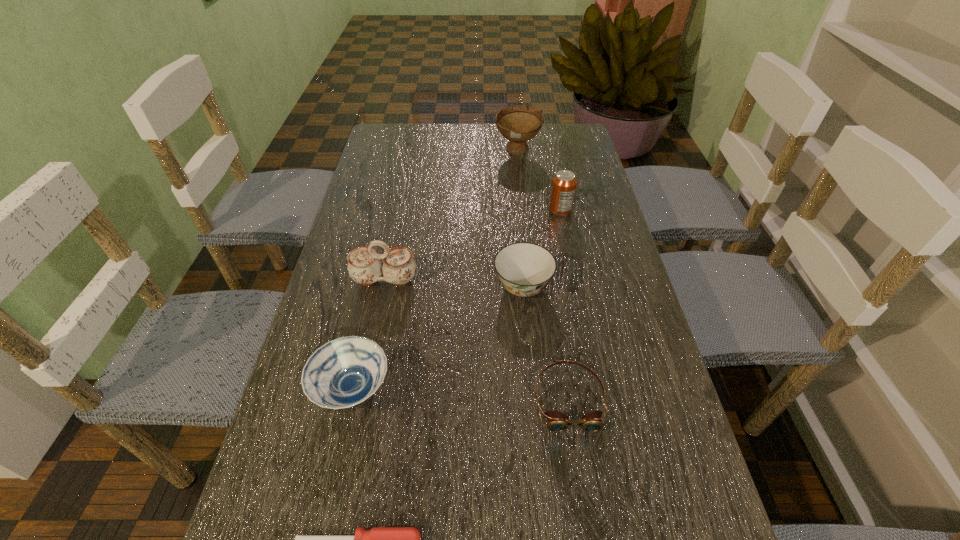
The width and height of the screenshot is (960, 540). What are the coordinates of `vacant space at the right edge of the desktop` in the screenshot? It's located at (602, 196).

The image size is (960, 540). In the image, there is a desktop. What are the coordinates of `vacant space at the far left corner` in the screenshot? It's located at (375, 153).

Image resolution: width=960 pixels, height=540 pixels. In the image, there is a desktop. Identify the location of vacant space at the far right corner. (584, 158).

Locate an element on the screen. free space that is in between the sixth tallest object and the chinaware is located at coordinates (476, 339).

Find the location of a particular element. The height and width of the screenshot is (540, 960). free space between the chinaware and the second nearest soup bowl is located at coordinates (454, 283).

In order to click on free space that is in between the second nearest soup bowl and the chinaware in this screenshot , I will do `click(454, 283)`.

You are a GUI agent. You are given a task and a screenshot of the screen. Output one action in this format:
    pyautogui.click(x=<x>, y=<y>)
    Task: Click on the vacant point located between the sixth nearest object and the nearest soup bowl
    
    Given the screenshot: What is the action you would take?
    pyautogui.click(x=456, y=300)

This screenshot has height=540, width=960. In order to click on free area in between the second nearest soup bowl and the nearest soup bowl in this screenshot , I will do `click(438, 338)`.

Where is `vacant point located between the chinaware and the can`? vacant point located between the chinaware and the can is located at coordinates (472, 245).

This screenshot has width=960, height=540. What are the coordinates of `object that ranks as the closest to the second farthest soup bowl` in the screenshot? It's located at coord(556,421).